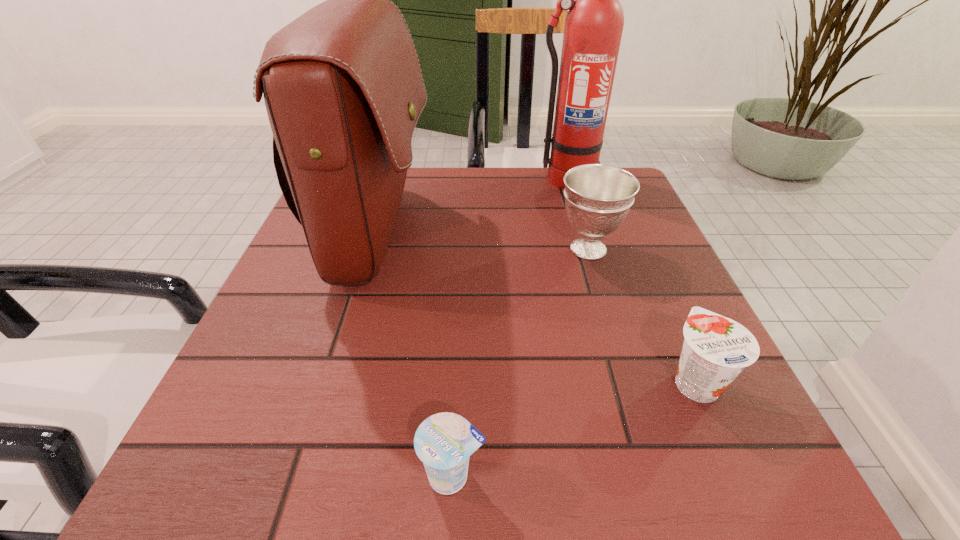
This screenshot has height=540, width=960. In order to click on vacant space that is in between the nearer yogurt and the fire extinguisher in this screenshot , I will do `click(509, 327)`.

This screenshot has height=540, width=960. I want to click on free area in between the fire extinguisher and the shortest object, so point(509,327).

I want to click on free space between the fourth farthest object and the leftmost object, so click(x=537, y=307).

Locate which object ranks in proximity to the fire extinguisher. Please provide its 2D coordinates. Your answer should be formatted as a tuple, i.e. [(x, y)], where the tuple contains the x and y coordinates of a point satisfying the conditions above.

[(598, 197)]

Where is `object that ranks as the second closest to the satchel`? object that ranks as the second closest to the satchel is located at coordinates (444, 441).

At what (x,y) coordinates should I click in order to perform the action: click on free space in the image that satisfies the following two spatial constraints: 1. on the open flap of the right yogurt; 2. on the right side of the leftmost object. Please return your answer as a coordinate pair (x, y). The height and width of the screenshot is (540, 960). Looking at the image, I should click on (334, 381).

Identify the location of free space that satisfies the following two spatial constraints: 1. on the front side of the third tallest object; 2. on the right side of the farther yogurt. (628, 381).

The height and width of the screenshot is (540, 960). I want to click on vacant region that satisfies the following two spatial constraints: 1. on the label side of the chalice; 2. on the right side of the fire extinguisher, so click(x=585, y=249).

This screenshot has width=960, height=540. I want to click on vacant space that satisfies the following two spatial constraints: 1. on the back side of the third tallest object; 2. on the right side of the shorter yogurt, so [x=464, y=249].

Where is `free spot that satisfies the following two spatial constraints: 1. on the label side of the fire extinguisher; 2. on the right side of the second nearest object`? The height and width of the screenshot is (540, 960). free spot that satisfies the following two spatial constraints: 1. on the label side of the fire extinguisher; 2. on the right side of the second nearest object is located at coordinates (624, 381).